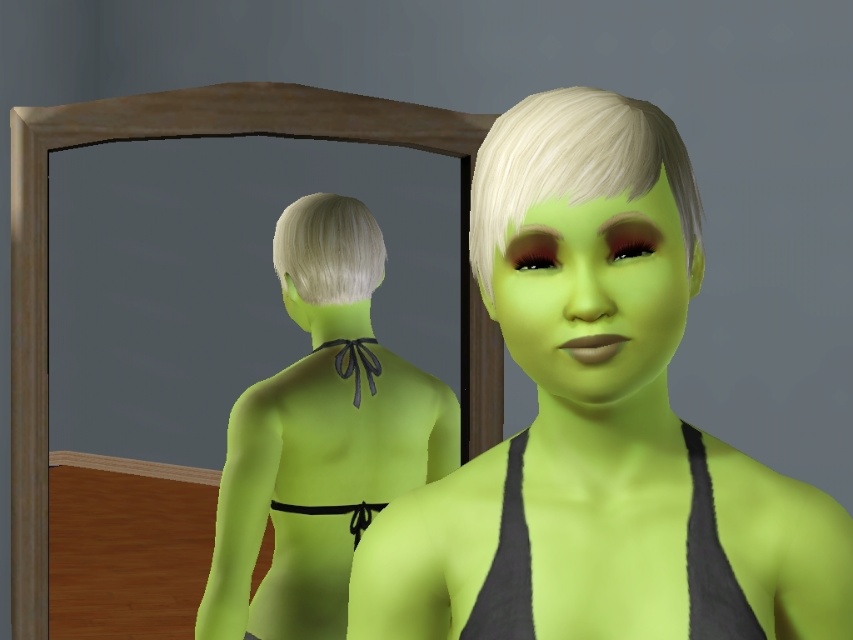
Which of these two, lime matte/black halter top at center or blonde matte hair at upper center, stands shorter?

Standing shorter between the two is blonde matte hair at upper center.

Is lime matte/black halter top at center shorter than blonde matte hair at upper center?

No.

In order to click on lime matte/black halter top at center in this screenshot , I will do `click(320, 436)`.

At what (x,y) coordinates should I click in order to perform the action: click on lime matte/black halter top at center. Please return your answer as a coordinate pair (x, y). Looking at the image, I should click on (320, 436).

Looking at this image, is blonde matte hair at upper center shorter than blonde silky hair at back?

Indeed, blonde matte hair at upper center has a lesser height compared to blonde silky hair at back.

The width and height of the screenshot is (853, 640). In order to click on blonde matte hair at upper center in this screenshot , I will do `click(573, 164)`.

Image resolution: width=853 pixels, height=640 pixels. I want to click on blonde matte hair at upper center, so click(573, 164).

Does lime matte skin at center appear over blonde matte hair at upper center?

No.

Is point (811, 538) farther from camera compared to point (508, 109)?

No, (811, 538) is closer to viewer.

Where is `lime matte skin at center`? This screenshot has height=640, width=853. lime matte skin at center is located at coordinates (598, 422).